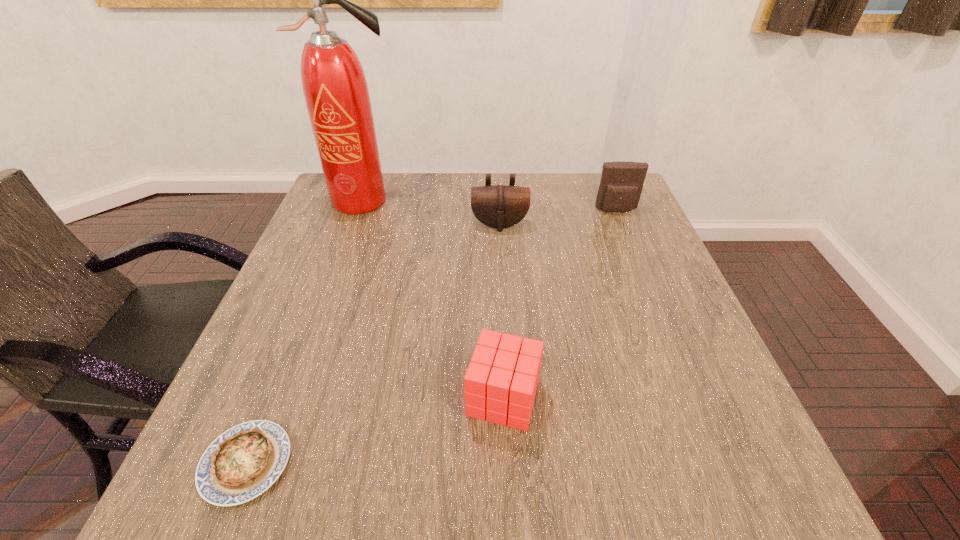
In the image, there is a desktop. Find the location of `vacant region at the far edge`. vacant region at the far edge is located at coordinates (546, 174).

The width and height of the screenshot is (960, 540). Find the location of `free space at the near edge of the desktop`. free space at the near edge of the desktop is located at coordinates (373, 457).

Locate an element on the screen. The height and width of the screenshot is (540, 960). free location at the left edge of the desktop is located at coordinates (302, 311).

Identify the location of vacant space at the right edge of the desktop. (659, 348).

In order to click on vacant space at the far right corner of the desktop in this screenshot , I will do `click(580, 186)`.

In the image, there is a desktop. At what (x,y) coordinates should I click in order to perform the action: click on vacant space at the near right corner. Please return your answer as a coordinate pair (x, y). The height and width of the screenshot is (540, 960). Looking at the image, I should click on (667, 461).

Where is `empty space between the rightmost object and the third nearest object`? This screenshot has height=540, width=960. empty space between the rightmost object and the third nearest object is located at coordinates (558, 217).

Identify the location of free space between the fourth tallest object and the shortest object. (374, 430).

Where is `free space between the third nearest object and the right pouch`? This screenshot has width=960, height=540. free space between the third nearest object and the right pouch is located at coordinates (558, 217).

This screenshot has width=960, height=540. I want to click on blank region between the tallest object and the shortest object, so click(x=304, y=332).